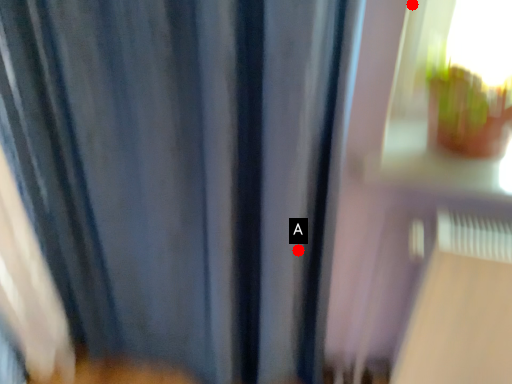
Question: Two points are circled on the image, labeled by A and B beside each circle. Among these points, which one is farthest from the camera?

Choices:
 (A) A is further
 (B) B is further

Answer: (A)